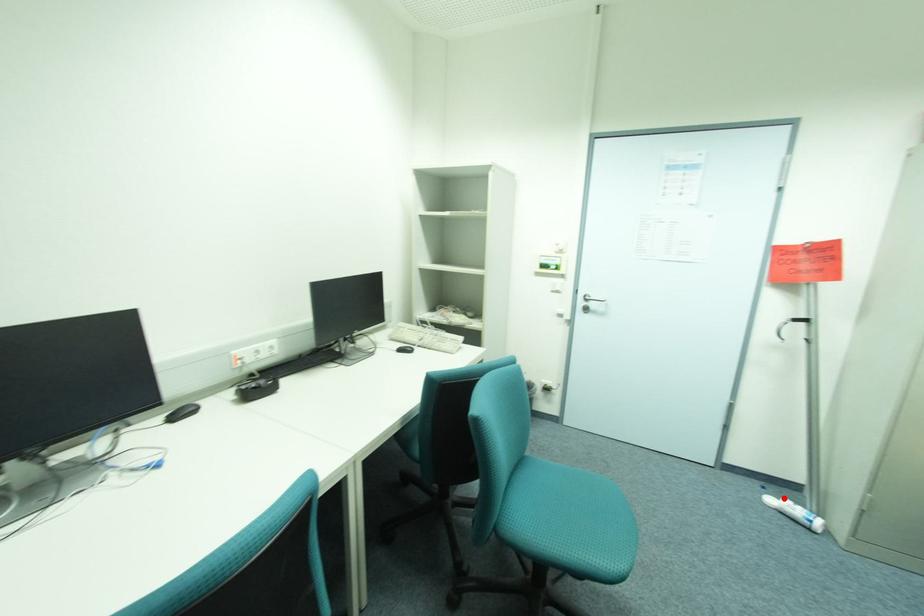
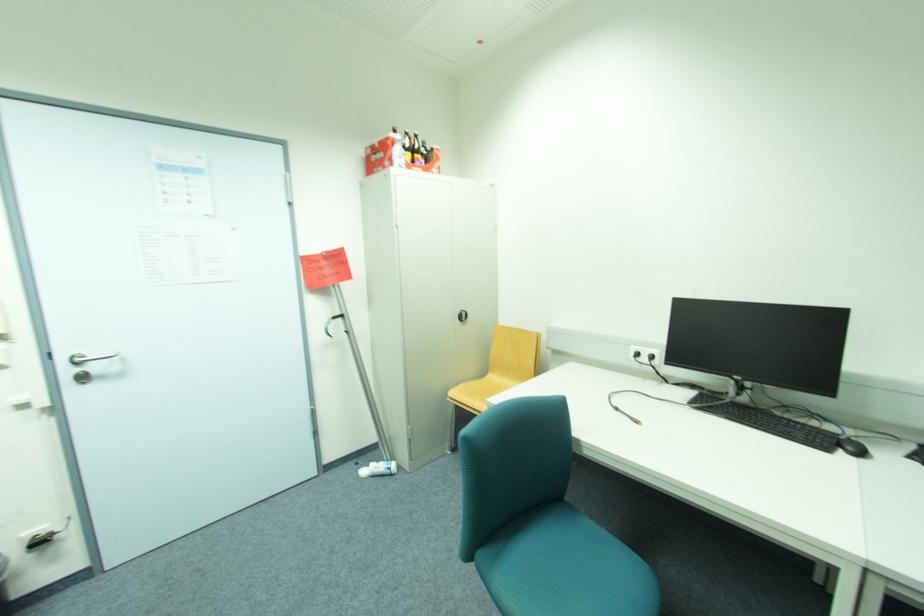
Find the pixel in the second image that matches the highlighted location in the first image.

(373, 468)